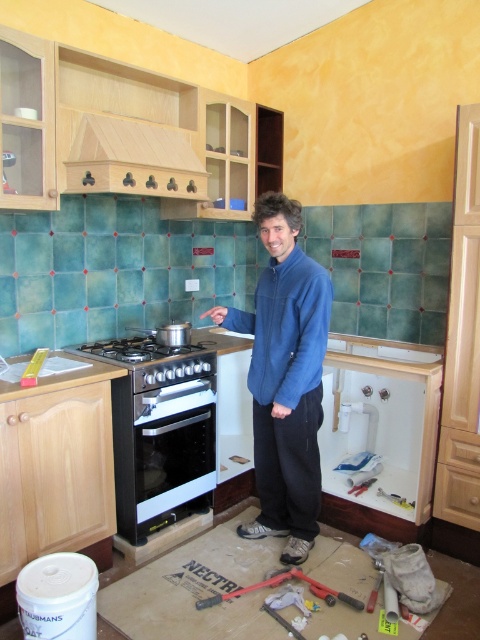
Does point (213, 445) come in front of point (360, 609)?

No, (213, 445) is behind (360, 609).

Is point (175, 406) more distant than point (359, 605)?

Yes, point (175, 406) is farther from viewer.

Locate an element on the screen. black glossy oven at center is located at coordinates (163, 449).

Describe the element at coordinates (163, 449) in the screenshot. I see `black glossy oven at center` at that location.

Who is more distant from viewer, (x=180, y=384) or (x=190, y=346)?

Positioned behind is point (x=190, y=346).

This screenshot has height=640, width=480. In order to click on black glossy oven at center in this screenshot , I will do `click(163, 449)`.

Which of these two, light wood/texture exhaust hood at upper center or matte black gas stove at center, stands taller?

Standing taller between the two is light wood/texture exhaust hood at upper center.

Who is shorter, light wood/texture exhaust hood at upper center or matte black gas stove at center?

matte black gas stove at center

You are a GUI agent. You are given a task and a screenshot of the screen. Output one action in this format:
    pyautogui.click(x=<x>, y=<y>)
    Task: Click on the light wood/texture exhaust hood at upper center
    The image size is (480, 640).
    Given the screenshot: What is the action you would take?
    pyautogui.click(x=131, y=157)